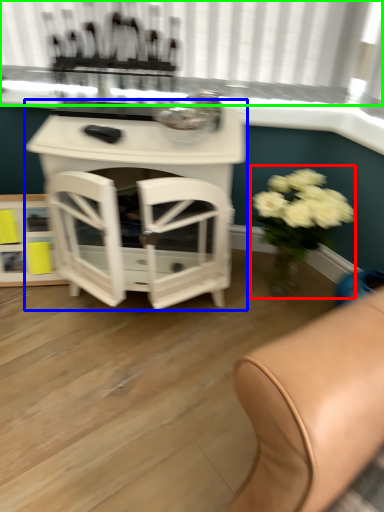
Question: Based on their relative distances, which object is nearer to floral arrangement (highlighted by a red box)? Choose from table (highlighted by a blue box) and bay window (highlighted by a green box).

Choices:
 (A) table
 (B) bay window

Answer: (A)